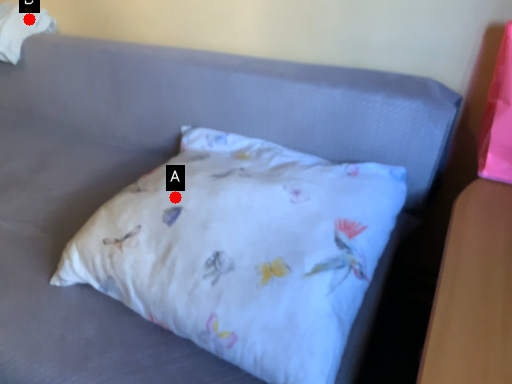
Question: Two points are circled on the image, labeled by A and B beside each circle. Which of the following is the farthest from the observer?

Choices:
 (A) A is further
 (B) B is further

Answer: (B)